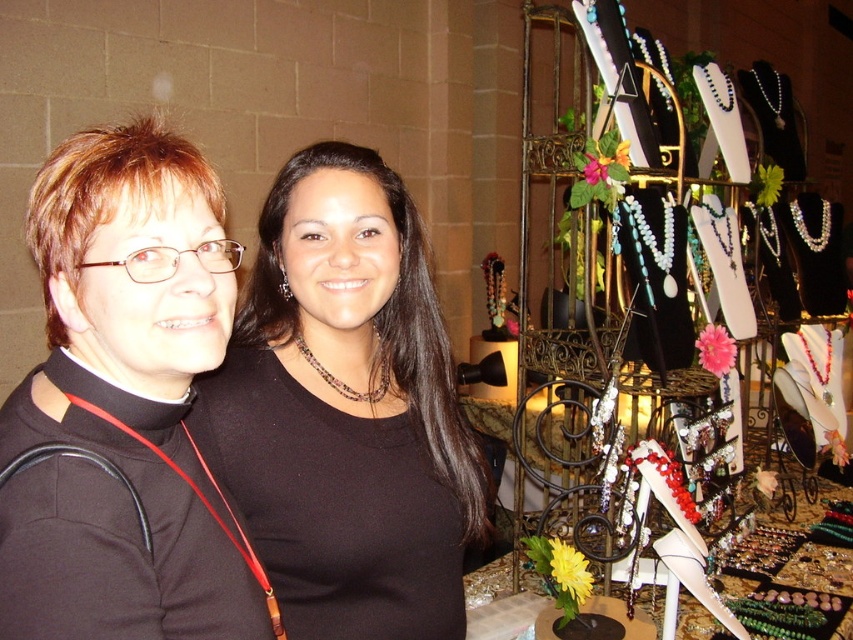
You are a customer in a jewelry store and see a matte black necklace at center. The store requires you to touch the necklace to try it on. The store uses a touch sensor at point (346, 410) to detect if you touched it. Did you touch the necklace?

Yes, the point (346, 410) corresponds to the matte black necklace at center, so touching that point would mean you touched the necklace.